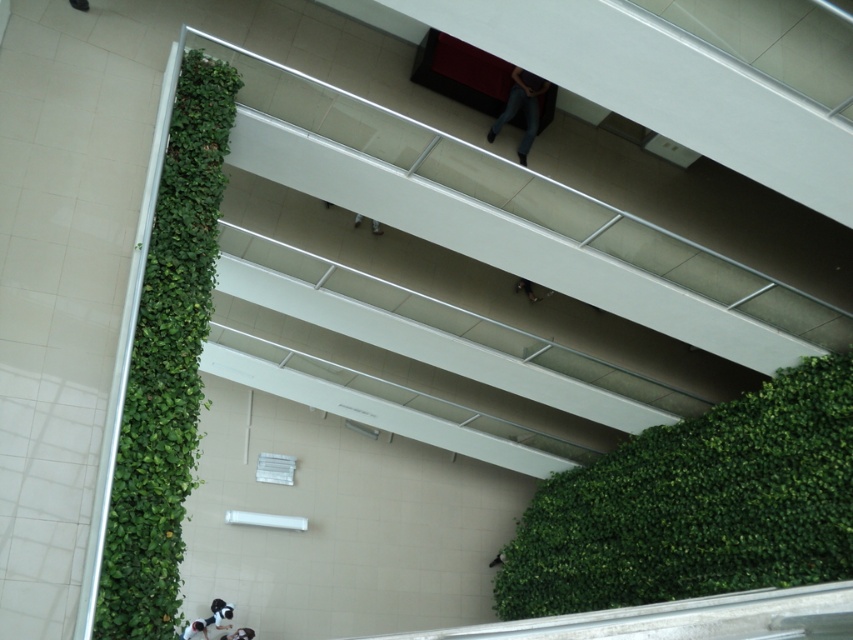
Question: Which of the following is the closest to the observer?

Choices:
 (A) denim jeans at upper center
 (B) green leafy wall at left
 (C) green leafy wall at lower right

Answer: (B)

Question: Does green leafy wall at lower right have a smaller size compared to green leafy wall at left?

Choices:
 (A) yes
 (B) no

Answer: (B)

Question: Which object is farther from the camera taking this photo?

Choices:
 (A) green leafy wall at left
 (B) green leafy wall at lower right
 (C) denim jeans at upper center

Answer: (C)

Question: Does green leafy wall at lower right have a greater width compared to green leafy wall at left?

Choices:
 (A) yes
 (B) no

Answer: (A)

Question: Which point appears farthest from the camera in this image?

Choices:
 (A) (190, 296)
 (B) (508, 96)
 (C) (572, 483)

Answer: (C)

Question: Is green leafy wall at left positioned before denim jeans at upper center?

Choices:
 (A) yes
 (B) no

Answer: (A)